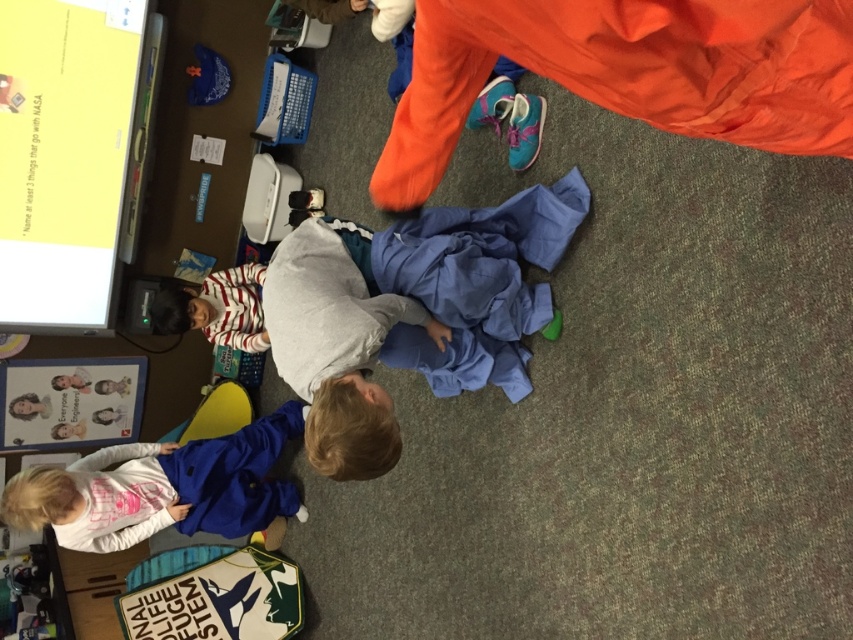
Question: Which object appears farthest from the camera in this image?

Choices:
 (A) gray soft shirt at center
 (B) blue fabric jacket at lower left

Answer: (B)

Question: Is gray soft shirt at center wider than blue fabric jacket at lower left?

Choices:
 (A) yes
 (B) no

Answer: (B)

Question: Among these objects, which one is farthest from the camera?

Choices:
 (A) gray soft shirt at center
 (B) blue fabric jacket at lower left

Answer: (B)

Question: Which point is closer to the camera taking this photo?

Choices:
 (A) (138, 465)
 (B) (361, 232)

Answer: (B)

Question: Observing the image, what is the correct spatial positioning of gray soft shirt at center in reference to blue fabric jacket at lower left?

Choices:
 (A) left
 (B) right

Answer: (B)

Question: Is gray soft shirt at center further to the viewer compared to blue fabric jacket at lower left?

Choices:
 (A) yes
 (B) no

Answer: (B)